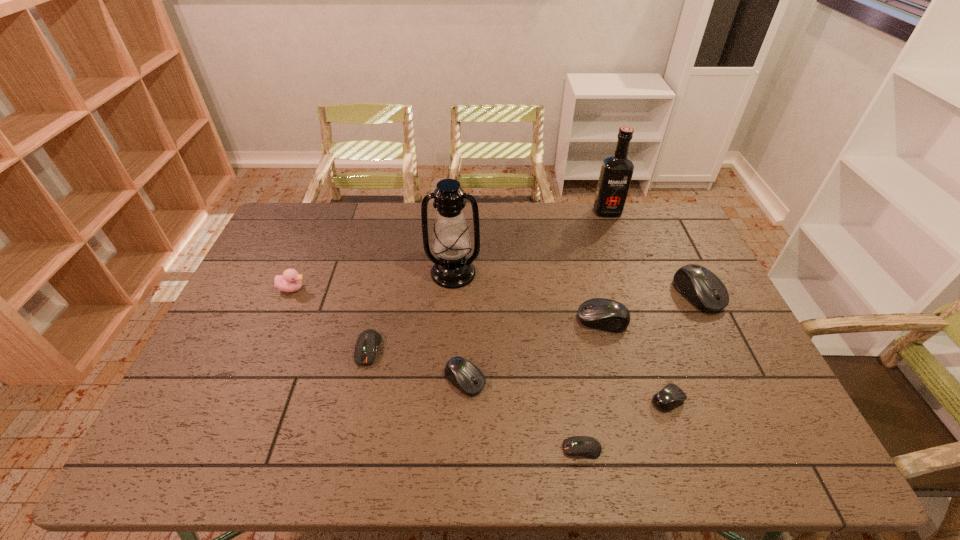
Find the location of a particular element. This screenshot has height=540, width=960. object that is at the right edge is located at coordinates (701, 287).

Locate an element on the screen. free space at the far edge of the desktop is located at coordinates (340, 230).

Identify the location of free space at the near edge of the desktop. The image size is (960, 540). (229, 451).

Find the location of a particular element. The width and height of the screenshot is (960, 540). vacant space at the left edge is located at coordinates (210, 399).

The height and width of the screenshot is (540, 960). What are the coordinates of `free space at the right edge of the desktop` in the screenshot? It's located at (719, 371).

Find the location of a particular element. vacant space at the far left corner is located at coordinates (316, 203).

At what (x,y) coordinates should I click in order to perform the action: click on free space at the far right corner of the desktop. Please return your answer as a coordinate pair (x, y). This screenshot has height=540, width=960. Looking at the image, I should click on (642, 232).

I want to click on empty space between the third tallest computer equipment and the third smallest black mouse, so click(534, 350).

Locate an element on the screen. This screenshot has height=540, width=960. free space between the tallest computer equipment and the nearer dark computer equipment is located at coordinates (640, 372).

This screenshot has width=960, height=540. What are the coordinates of `blank region between the liquor and the left dark computer equipment` in the screenshot? It's located at (488, 280).